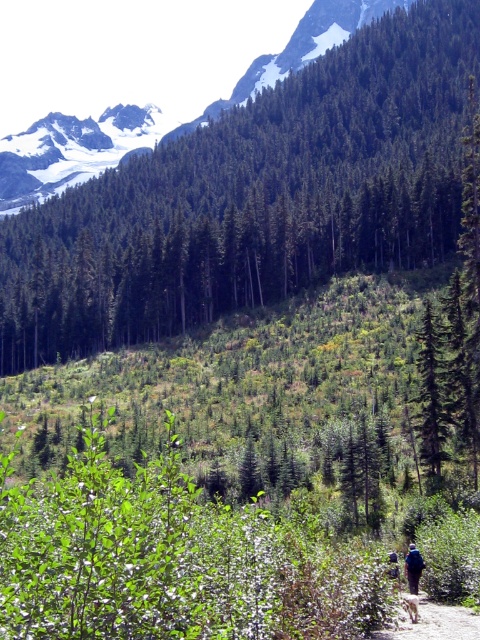
Question: Can you confirm if green matte tree at center is wider than blue fabric backpack at lower right?

Choices:
 (A) yes
 (B) no

Answer: (A)

Question: From the image, what is the correct spatial relationship of green matte tree at center in relation to dirt path at lower right?

Choices:
 (A) below
 (B) above

Answer: (B)

Question: Is dirt path at lower right positioned before blue fabric backpack at lower right?

Choices:
 (A) no
 (B) yes

Answer: (B)

Question: Which object is positioned closest to the blue fabric backpack at lower right?

Choices:
 (A) green matte tree at center
 (B) dirt path at lower right

Answer: (B)

Question: Estimate the real-world distances between objects in this image. Which object is closer to the dirt path at lower right?

Choices:
 (A) blue fabric backpack at lower right
 (B) green matte tree at center

Answer: (A)

Question: Which point is closer to the camera taking this photo?

Choices:
 (A) (164, 198)
 (B) (477, 620)

Answer: (B)